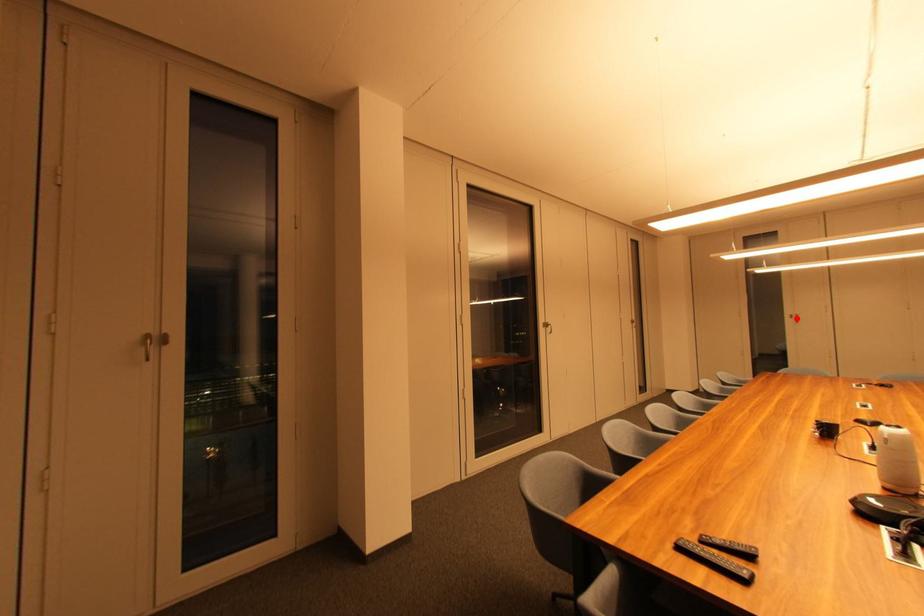
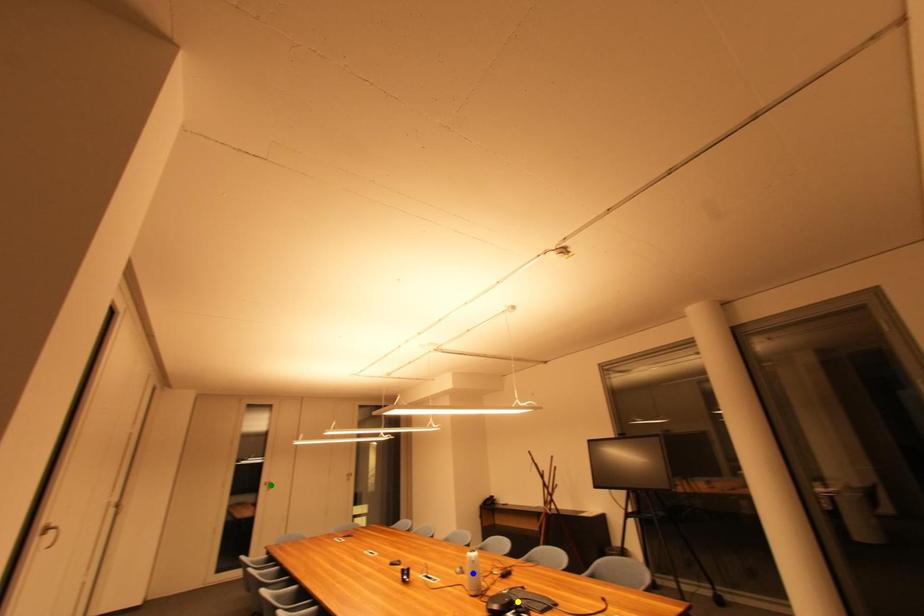
Question: I am providing you with two images of the same scene from different viewpoints. A red point is marked on the first image. You are given multiple points on the second image. Can you choose the point in image 2 that corresponds to the point in image 1?

Choices:
 (A) yellow point
 (B) green point
 (C) blue point

Answer: (B)